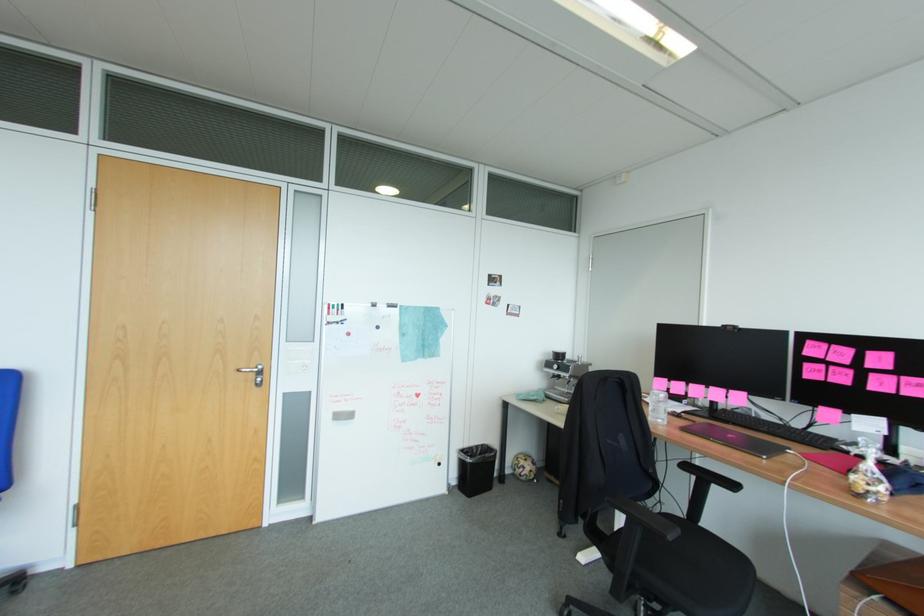
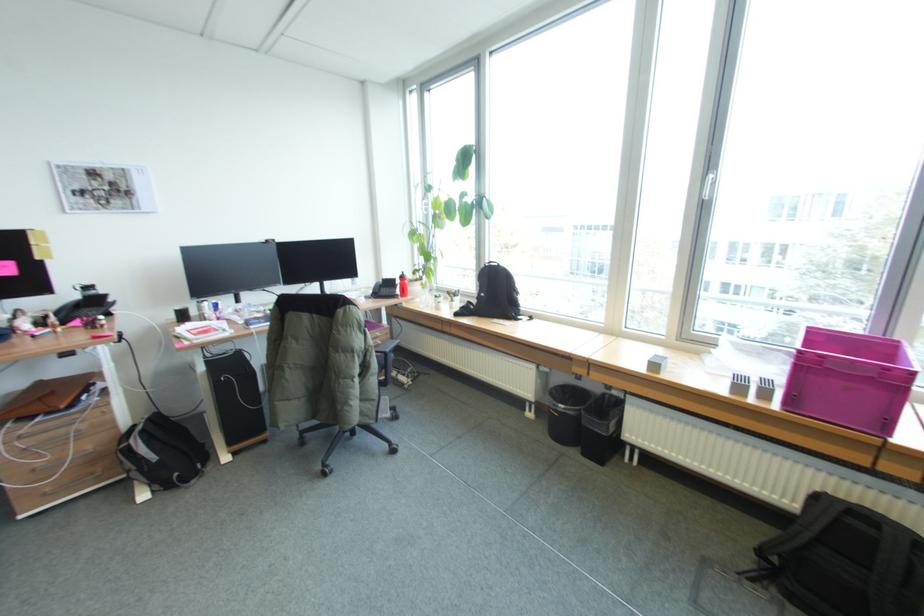
Based on the continuous images, in which direction is the camera rotating?

The camera's rotation is toward right-down.